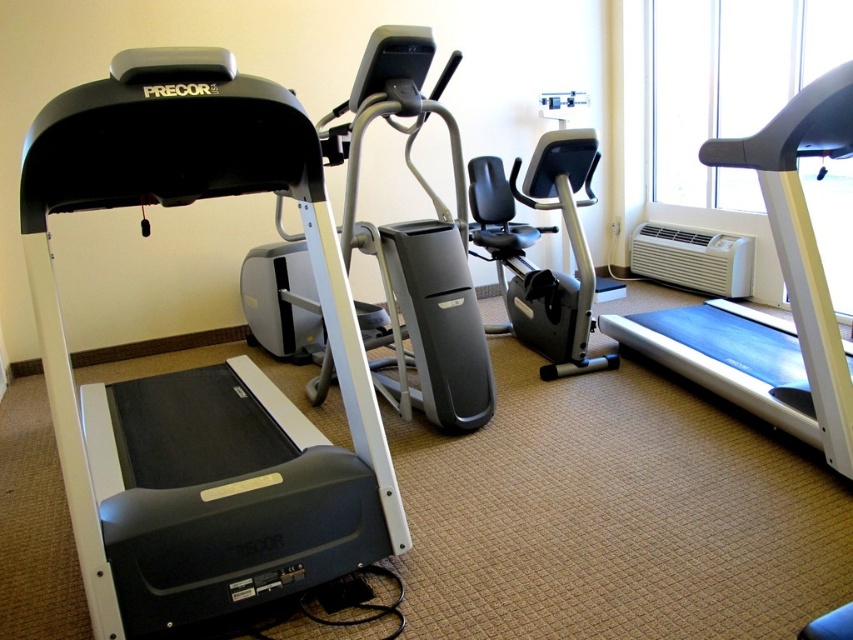
Question: Is matte black treadmill at left wider than blue rubber treadmill at right?

Choices:
 (A) no
 (B) yes

Answer: (B)

Question: Can you confirm if matte black treadmill at left is positioned below blue rubber treadmill at right?

Choices:
 (A) yes
 (B) no

Answer: (A)

Question: Which point is farther from the camera taking this photo?

Choices:
 (A) (274, 490)
 (B) (613, 337)

Answer: (B)

Question: Which point appears closest to the camera in this image?

Choices:
 (A) (360, 481)
 (B) (827, 365)

Answer: (A)

Question: Is matte black treadmill at left smaller than blue rubber treadmill at right?

Choices:
 (A) no
 (B) yes

Answer: (A)